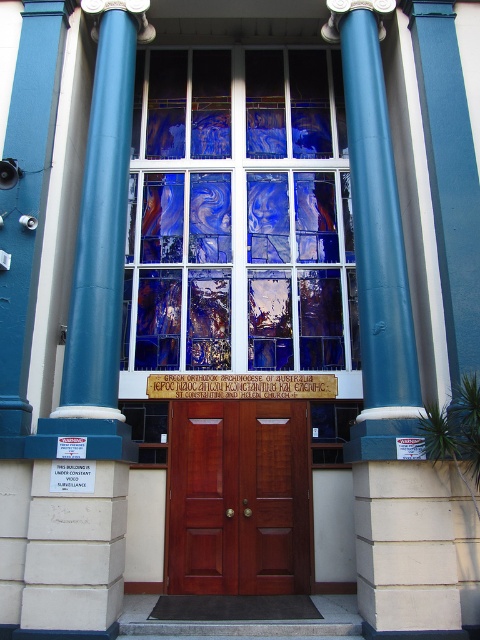
Question: Which point is closer to the camera?

Choices:
 (A) teal polished column at center
 (B) mahogany wood door at center
 (C) smooth blue column at left
 (D) blue stained glass at center

Answer: (C)

Question: Which object appears farthest from the camera in this image?

Choices:
 (A) teal polished column at center
 (B) blue stained glass at center
 (C) mahogany wood door at center
 (D) smooth blue column at left

Answer: (B)

Question: Is smooth blue column at left to the right of mahogany wood door at center from the viewer's perspective?

Choices:
 (A) no
 (B) yes

Answer: (A)

Question: Is smooth blue column at left below mahogany wood door at center?

Choices:
 (A) no
 (B) yes

Answer: (A)

Question: Which point appears closest to the camera in this image?

Choices:
 (A) (374, 461)
 (B) (100, 586)

Answer: (B)

Question: Is blue stained glass at center positioned in front of mahogany wood door at center?

Choices:
 (A) no
 (B) yes

Answer: (A)